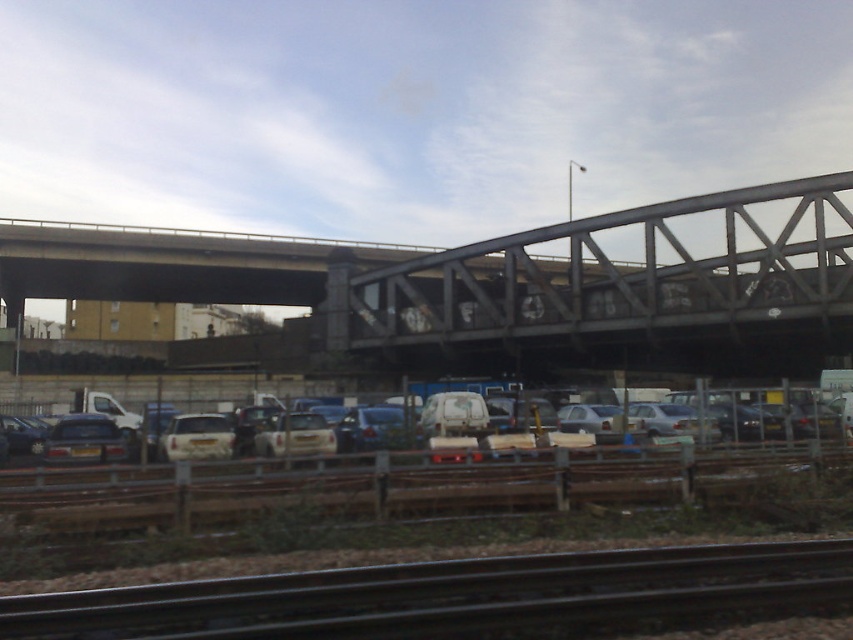
You are standing at the base of the railway bridge and want to take a photo of both point (770,224) and point (282,422) in the parking lot. Which point will appear closer to the top of your camera frame?

Point (770,224) is further to the camera than point (282,422), so it will appear closer to the top of your camera frame.

You are a delivery driver who needs to park your truck between the matte black car at left and the silver metallic car at center. Can you fit your truck, which is 2 meters wide, in the space between them?

The matte black car at left is positioned on the left side of the silver metallic car at center, but the exact width of the space between them is not provided. Without knowing the distance between the two cars, it is impossible to determine if the truck can fit.